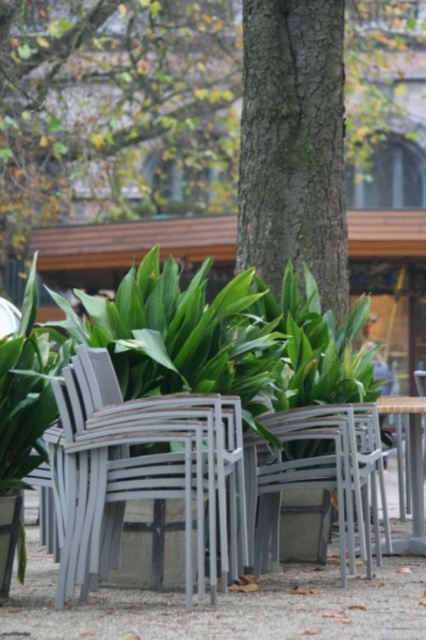
Question: Based on their relative distances, which object is nearer to the smooth bark tree trunk at center?

Choices:
 (A) metallic silver chair at center
 (B) green rough bark tree at center

Answer: (A)

Question: Can you confirm if metallic gray chair at center is positioned to the left of metallic silver chair at center?

Choices:
 (A) no
 (B) yes

Answer: (B)

Question: Does smooth bark tree trunk at center appear on the right side of metallic silver chair at center?

Choices:
 (A) no
 (B) yes

Answer: (A)

Question: Is green rough bark tree at center above metallic silver table at center?

Choices:
 (A) no
 (B) yes

Answer: (B)

Question: Which point is closer to the camera?

Choices:
 (A) smooth bark tree trunk at center
 (B) green rough bark tree at center

Answer: (A)

Question: Which object appears farthest from the camera in this image?

Choices:
 (A) green rough bark tree at center
 (B) metallic gray chair at center
 (C) metallic silver chair at center

Answer: (A)